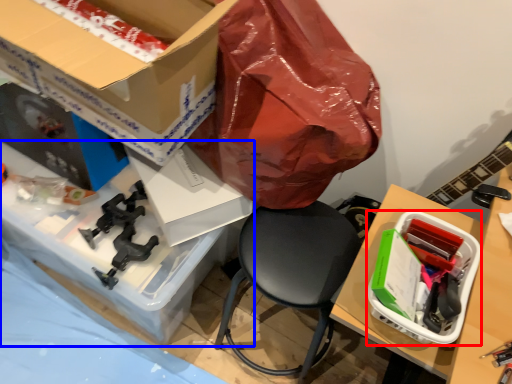
Question: Which object is closer to the camera taking this photo, box (highlighted by a red box) or desk (highlighted by a blue box)?

Choices:
 (A) box
 (B) desk

Answer: (A)